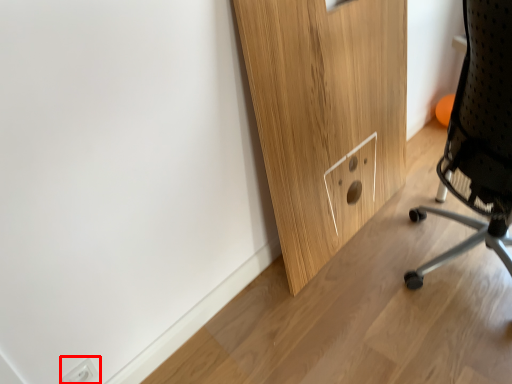
Question: In this image, where is electric outlet (annotated by the red box) located relative to chair?

Choices:
 (A) right
 (B) left

Answer: (B)